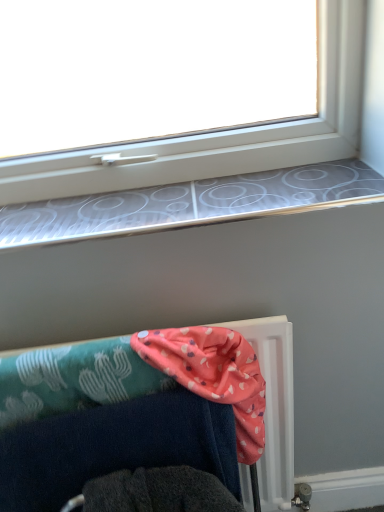
Question: Is pink fabric at lower center at the left side of pink fabric at lower right?

Choices:
 (A) no
 (B) yes

Answer: (A)

Question: Does pink fabric at lower center have a lesser height compared to pink fabric at lower right?

Choices:
 (A) yes
 (B) no

Answer: (A)

Question: Can you confirm if pink fabric at lower center is bigger than pink fabric at lower right?

Choices:
 (A) no
 (B) yes

Answer: (A)

Question: Could you tell me if pink fabric at lower center is facing pink fabric at lower right?

Choices:
 (A) no
 (B) yes

Answer: (B)

Question: From a real-world perspective, is pink fabric at lower center on pink fabric at lower right?

Choices:
 (A) yes
 (B) no

Answer: (A)

Question: Considering the relative positions of pink fabric at lower center and pink fabric at lower right in the image provided, is pink fabric at lower center to the right of pink fabric at lower right from the viewer's perspective?

Choices:
 (A) no
 (B) yes

Answer: (B)

Question: Is pink fabric at lower right behind silver metallic window sill at upper center?

Choices:
 (A) yes
 (B) no

Answer: (B)

Question: Is pink fabric at lower right bigger than silver metallic window sill at upper center?

Choices:
 (A) yes
 (B) no

Answer: (A)

Question: Is pink fabric at lower right wider than silver metallic window sill at upper center?

Choices:
 (A) yes
 (B) no

Answer: (B)

Question: Can you confirm if pink fabric at lower right is thinner than silver metallic window sill at upper center?

Choices:
 (A) yes
 (B) no

Answer: (A)

Question: Are pink fabric at lower right and silver metallic window sill at upper center making contact?

Choices:
 (A) yes
 (B) no

Answer: (B)

Question: Would you say silver metallic window sill at upper center is part of pink fabric at lower right's contents?

Choices:
 (A) no
 (B) yes

Answer: (A)

Question: Does pink fabric at lower center have a lesser width compared to silver metallic window sill at upper center?

Choices:
 (A) yes
 (B) no

Answer: (A)